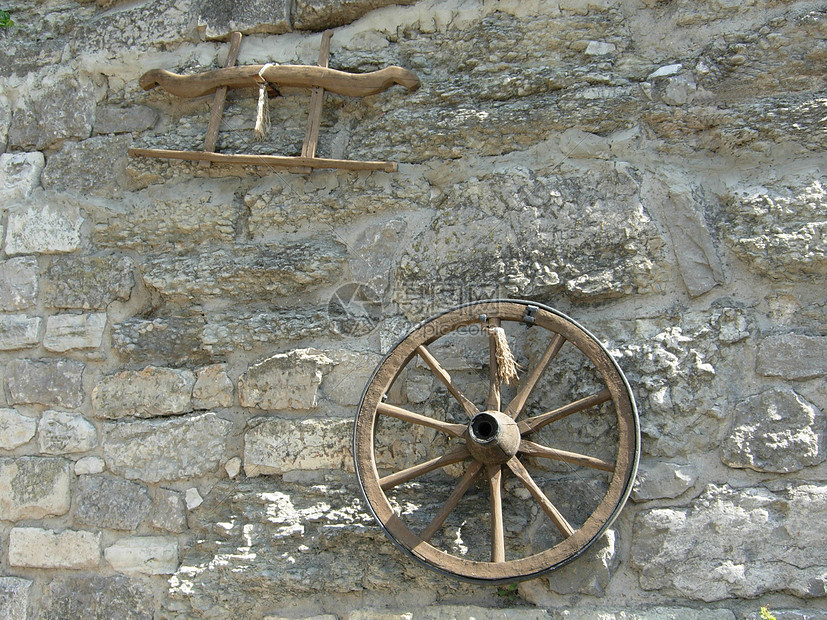
Image resolution: width=827 pixels, height=620 pixels. I want to click on tassle hanging down, so click(x=257, y=105), click(x=260, y=125).